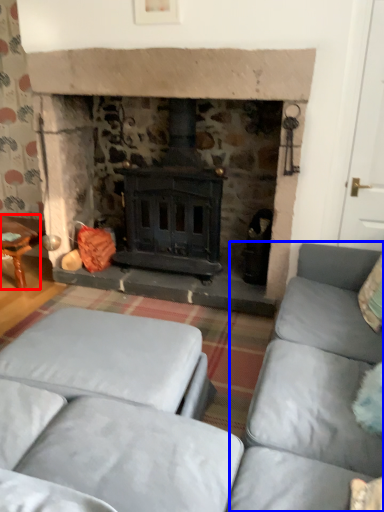
Question: Which point is closer to the camera, table (highlighted by a red box) or couch (highlighted by a blue box)?

Choices:
 (A) table
 (B) couch

Answer: (B)